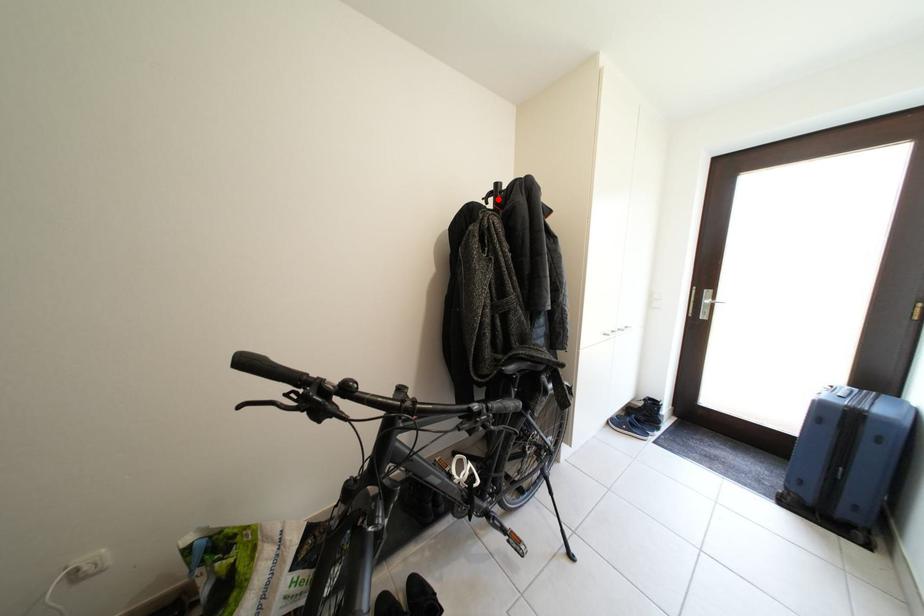
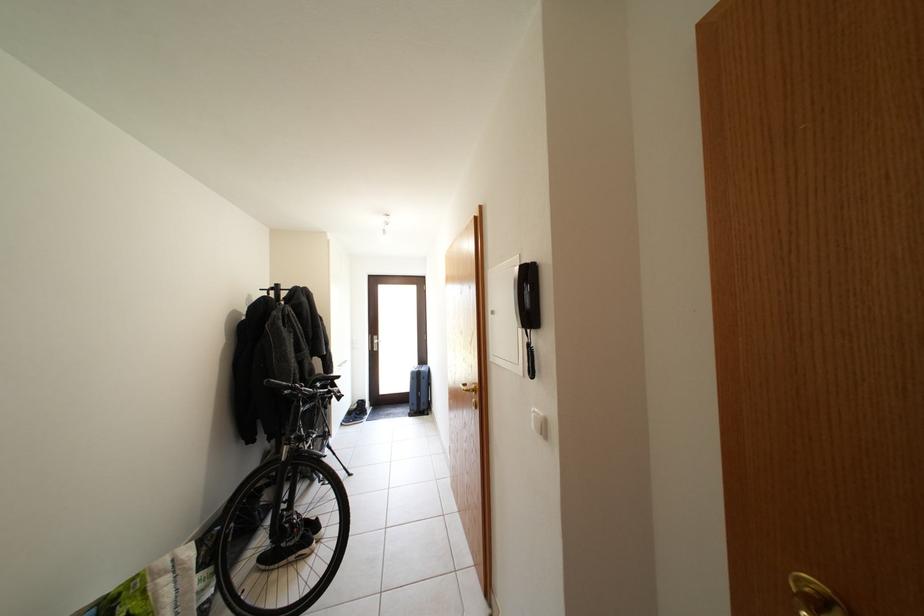
The point at the highlighted location is marked in the first image. Where is the corresponding point in the second image?

(281, 294)